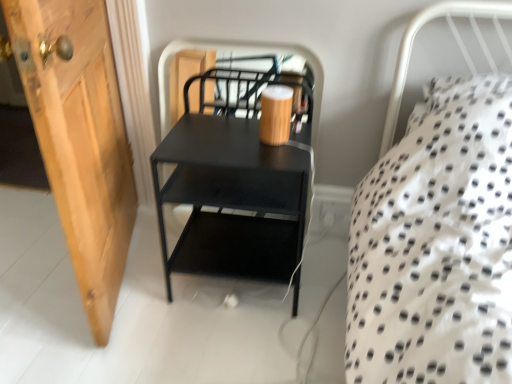
Find the location of a particular element. This screenshot has width=512, height=384. free space in front of black matte nightstand at center is located at coordinates (231, 344).